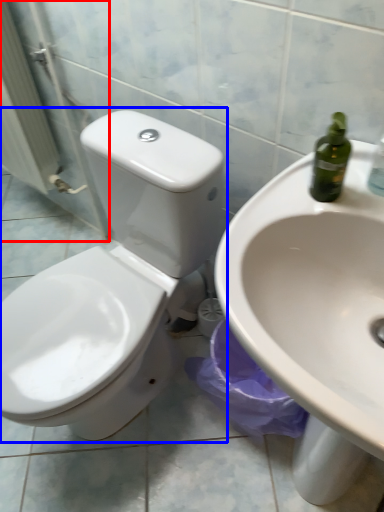
Question: Which object appears farthest to the camera in this image, screen door (highlighted by a red box) or toilet (highlighted by a blue box)?

Choices:
 (A) screen door
 (B) toilet

Answer: (A)